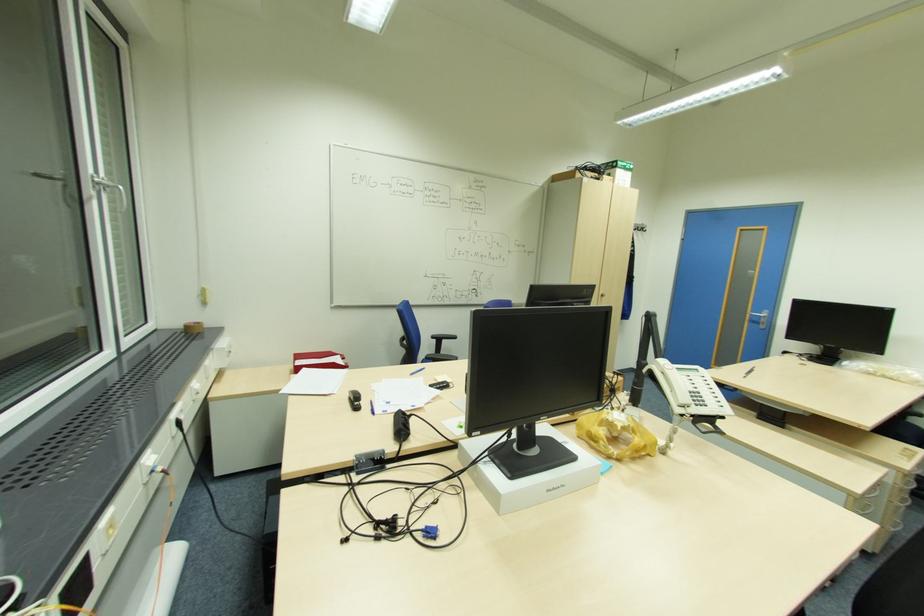
Locate an element on the screen. Image resolution: width=924 pixels, height=616 pixels. white telephone handset is located at coordinates (671, 382).